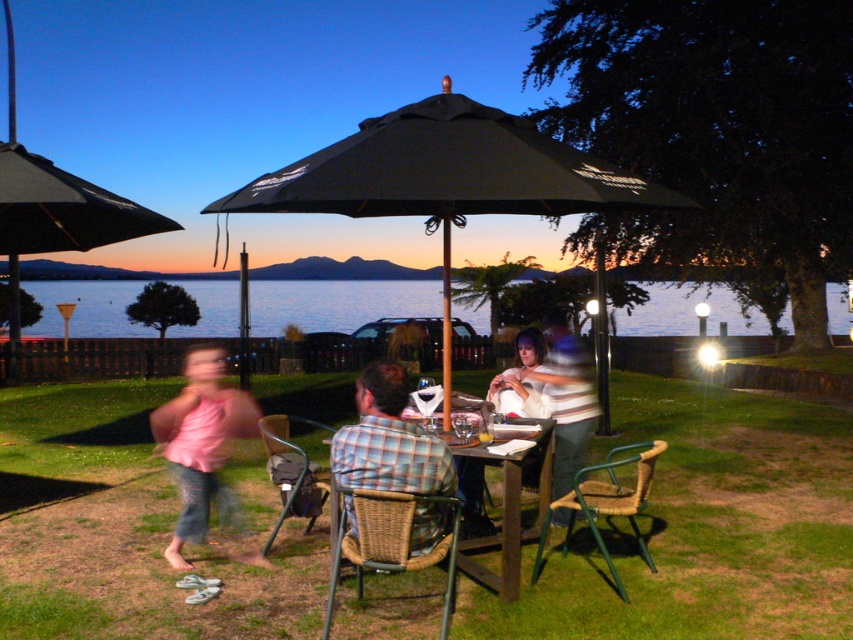
Question: Can you confirm if plaid fabric shirt at center is thinner than woven wicker chair at center?

Choices:
 (A) yes
 (B) no

Answer: (A)

Question: Which object is closer to the camera taking this photo?

Choices:
 (A) black fabric umbrella at upper left
 (B) blue water at center

Answer: (A)

Question: Which is nearer to the plaid fabric shirt at center?

Choices:
 (A) striped cotton shirt at center
 (B) black fabric umbrella at center
 (C) wooden table at center

Answer: (C)

Question: Among these objects, which one is nearest to the camera?

Choices:
 (A) blue water at center
 (B) wooden table at center
 (C) pink fabric shirt at lower left

Answer: (B)

Question: Where is black fabric umbrella at center located in relation to striped cotton shirt at center in the image?

Choices:
 (A) below
 (B) above

Answer: (B)

Question: Observing the image, what is the correct spatial positioning of pink fabric shirt at lower left in reference to wooden table at center?

Choices:
 (A) above
 (B) below

Answer: (A)